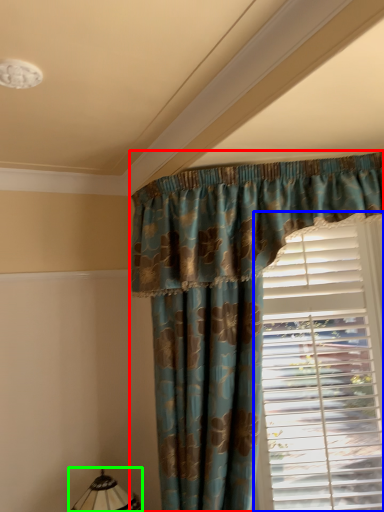
Question: Which object is positioned farthest from curtain (highlighted by a red box)? Select from window blind (highlighted by a blue box) and table lamp (highlighted by a green box).

Choices:
 (A) window blind
 (B) table lamp

Answer: (B)